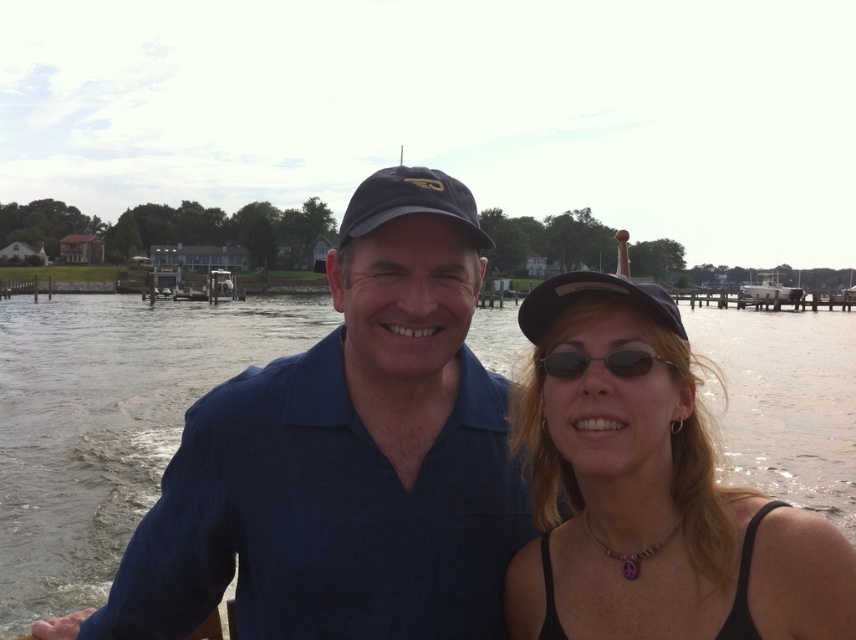
Question: Is black fabric tank top at center positioned in front of matte black baseball cap at center?

Choices:
 (A) no
 (B) yes

Answer: (B)

Question: Does blue fabric shirt at center have a larger size compared to black plastic sunglasses at center?

Choices:
 (A) yes
 (B) no

Answer: (A)

Question: Which point appears closest to the camera in this image?

Choices:
 (A) (571, 372)
 (B) (714, 540)

Answer: (B)

Question: Based on their relative distances, which object is nearer to the black fabric tank top at center?

Choices:
 (A) clear water at center
 (B) matte black baseball cap at center
 (C) blue fabric shirt at center
 (D) black plastic sunglasses at center

Answer: (D)

Question: Which object is positioned farthest from the black fabric tank top at center?

Choices:
 (A) matte black baseball cap at center
 (B) black plastic sunglasses at center
 (C) clear water at center
 (D) blue fabric shirt at center

Answer: (C)

Question: In this image, where is matte black baseball cap at center located relative to black plastic sunglasses at center?

Choices:
 (A) above
 (B) below

Answer: (A)